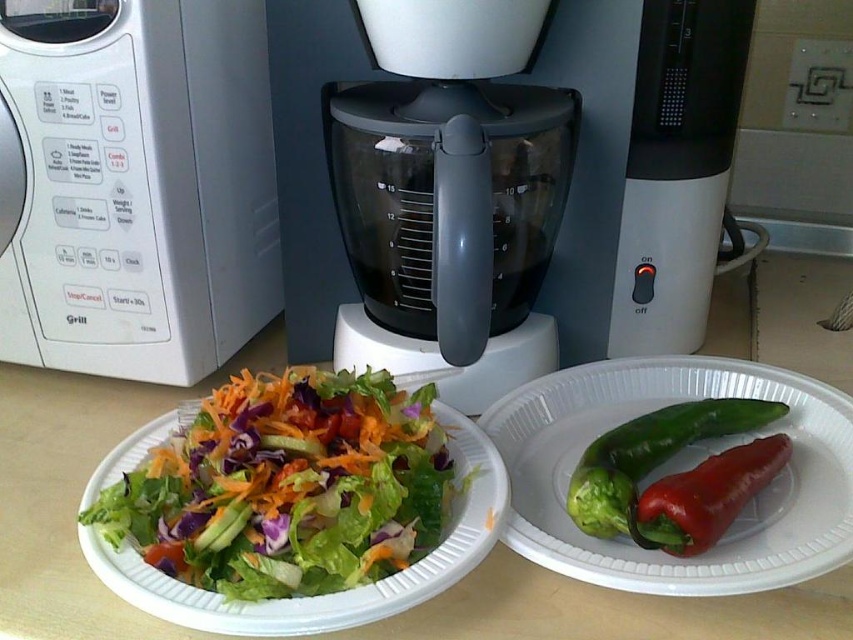
You are preparing to make a smoothie and need to know which item is taller between the transparent plastic food processor at center and the fresh green salad at center. Which one is taller?

The transparent plastic food processor at center is taller than the fresh green salad at center.

You are preparing to place the green matte pepper at center onto the green matte paper plate at right. Considering their sizes, will the pepper fit on the plate?

The green matte paper plate at right is bigger than the green matte pepper at center, so the pepper will fit on the plate.

You are a chef preparing a meal and need to reach both the transparent plastic food processor at center and the green matte pepper at center. Which item will you grab first if you want to pick up the one closer to you?

The transparent plastic food processor at center is closer to you, so you will grab it first before the green matte pepper at center.